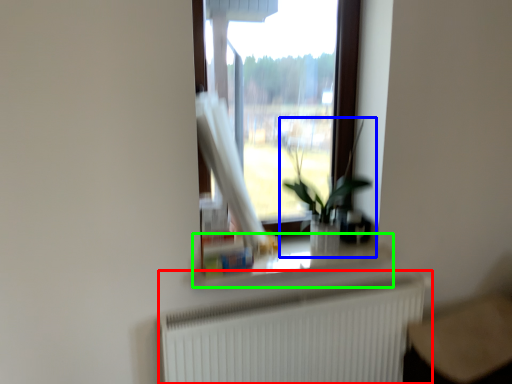
Question: Which is nearer to the radiator (highlighted by a red box)? houseplant (highlighted by a blue box) or window sill (highlighted by a green box).

Choices:
 (A) houseplant
 (B) window sill

Answer: (B)